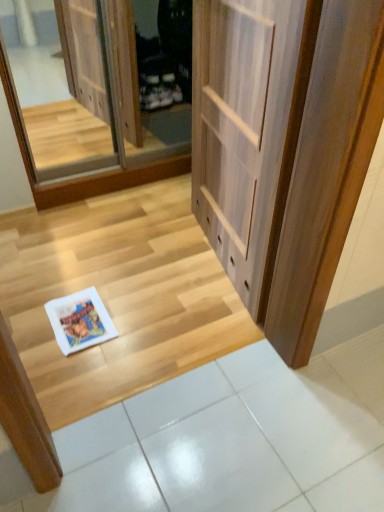
At what (x,y) coordinates should I click in order to perform the action: click on vacant area that lies to the right of white paper magazine at lower left. Please return your answer as a coordinate pair (x, y). The height and width of the screenshot is (512, 384). Looking at the image, I should click on (139, 326).